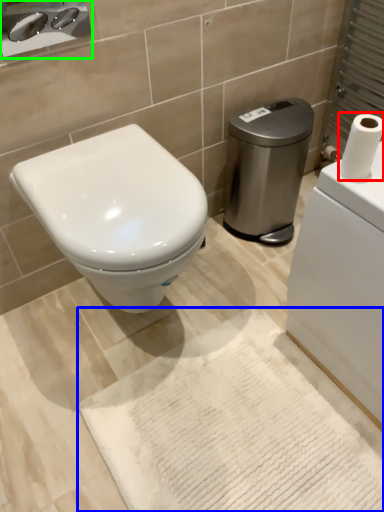
Question: Which object is positioned farthest from toilet paper (highlighted by a red box)? Select from bath mat (highlighted by a blue box) and sink (highlighted by a green box).

Choices:
 (A) bath mat
 (B) sink

Answer: (B)